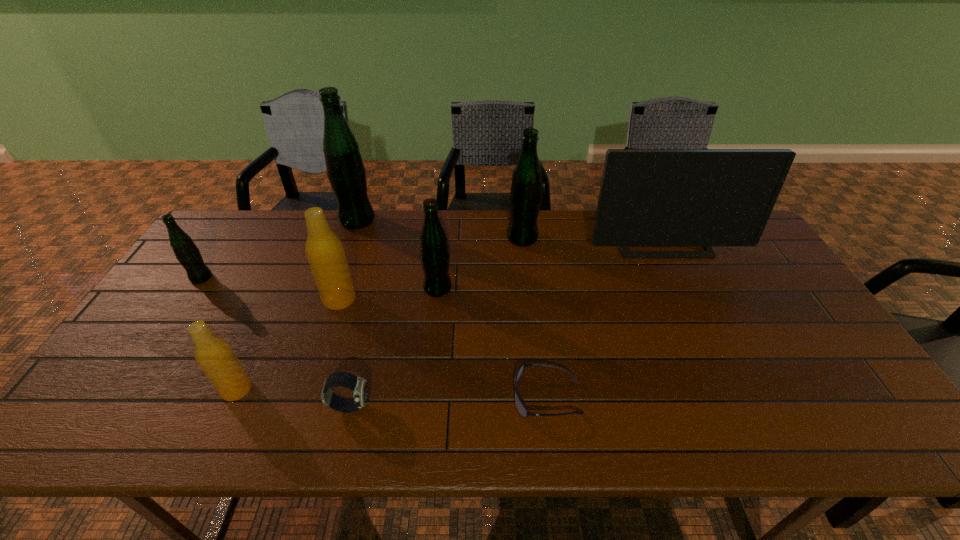
Find the location of a particular element. The height and width of the screenshot is (540, 960). empty space between the second green beer bottle from left to right and the bigger tan beer bottle is located at coordinates (348, 260).

This screenshot has height=540, width=960. I want to click on vacant space that is in between the second green beer bottle from right to left and the third smallest green beer bottle, so click(480, 264).

In order to click on vacant region between the shortest object and the fifth object from left to right in this screenshot , I will do `click(448, 401)`.

This screenshot has height=540, width=960. What are the coordinates of `vacant area that lies between the tallest object and the third green beer bottle from left to right` in the screenshot? It's located at (397, 254).

The image size is (960, 540). I want to click on vacant space in between the tallest object and the watch, so click(353, 313).

Find the location of a particular element. Image resolution: width=960 pixels, height=540 pixels. empty space that is in between the computer monitor and the dark watch is located at coordinates (506, 323).

Find the location of a particular element. empty location between the right tan beer bottle and the leftmost object is located at coordinates [x=271, y=288].

Identify which object is located as the second nearest to the tallest object. Please provide its 2D coordinates. Your answer should be formatted as a tuple, i.e. [(x, y)], where the tuple contains the x and y coordinates of a point satisfying the conditions above.

[(434, 254)]

Locate which object ranks sixth in proximity to the watch. Please provide its 2D coordinates. Your answer should be formatted as a tuple, i.e. [(x, y)], where the tuple contains the x and y coordinates of a point satisfying the conditions above.

[(346, 172)]

In order to click on beer bottle object that ranks as the fourth closest to the smallest green beer bottle in this screenshot , I will do `click(434, 254)`.